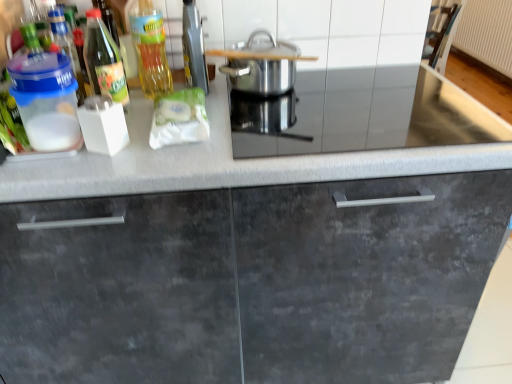
The image size is (512, 384). I want to click on blank space above white matte packet at center (from a real-world perspective), so click(179, 105).